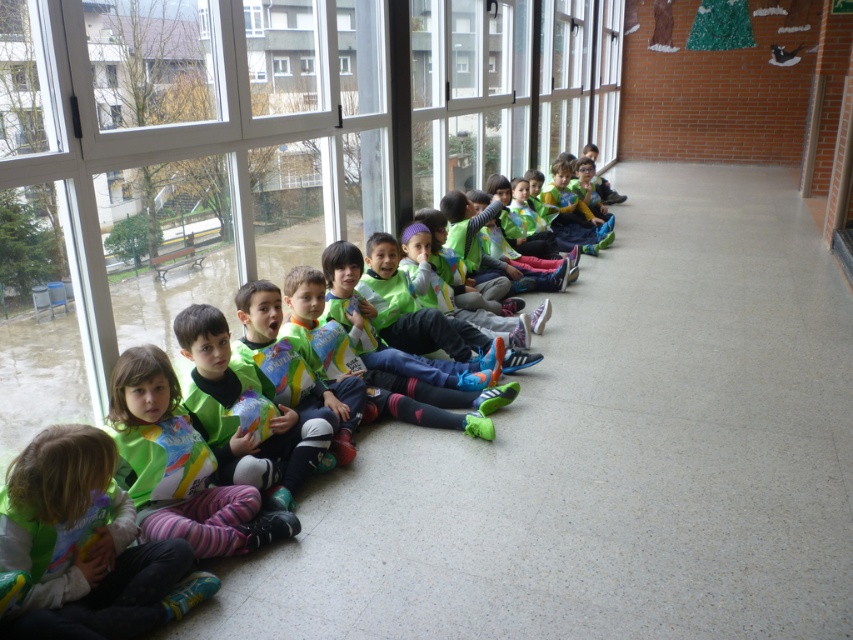
Does green matte vest at center have a lesser height compared to transparent glass window at upper center?

Incorrect, green matte vest at center's height does not fall short of transparent glass window at upper center's.

Who is positioned more to the left, green matte vest at center or transparent glass window at upper center?

green matte vest at center

Is point (244, 504) more distant than point (279, 74)?

No, it is in front of (279, 74).

The width and height of the screenshot is (853, 640). I want to click on green matte vest at center, so click(178, 465).

Is matte green jacket at lower left below transparent glass window at upper center?

Yes, matte green jacket at lower left is below transparent glass window at upper center.

You are a GUI agent. You are given a task and a screenshot of the screen. Output one action in this format:
    pyautogui.click(x=<x>, y=<y>)
    Task: Click on the matte green jacket at lower left
    The height and width of the screenshot is (640, 853).
    Given the screenshot: What is the action you would take?
    pyautogui.click(x=86, y=547)

You are a GUI agent. You are given a task and a screenshot of the screen. Output one action in this format:
    pyautogui.click(x=<x>, y=<y>)
    Task: Click on the matte green jacket at lower left
    
    Given the screenshot: What is the action you would take?
    pyautogui.click(x=86, y=547)

Between matte green jacket at lower left and green matte vest at center, which one appears on the left side from the viewer's perspective?

matte green jacket at lower left is more to the left.

Is matte green jacket at lower left wider than green matte vest at center?

No, matte green jacket at lower left is not wider than green matte vest at center.

Who is more forward, (44, 452) or (276, 536)?

Point (44, 452)

The image size is (853, 640). In order to click on matte green jacket at lower left in this screenshot , I will do `click(86, 547)`.